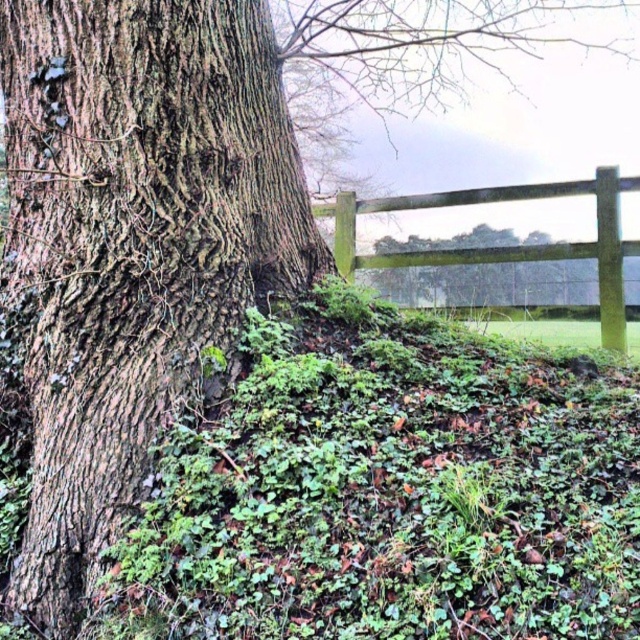
Question: Which of these objects is positioned farthest from the green wood fence at center?

Choices:
 (A) brown rough bark tree trunk at left
 (B) green mossy tree at center

Answer: (A)

Question: Which object is positioned farthest from the brown rough bark tree trunk at left?

Choices:
 (A) green mossy tree at center
 (B) green wood fence at center

Answer: (A)

Question: Which point appears closest to the camera in this image?

Choices:
 (A) (490, 289)
 (B) (378, 205)
 (C) (152, 298)

Answer: (C)

Question: Is brown rough bark tree trunk at left smaller than green mossy tree at center?

Choices:
 (A) yes
 (B) no

Answer: (B)

Question: Is brown rough bark tree trunk at left further to the viewer compared to green mossy tree at center?

Choices:
 (A) yes
 (B) no

Answer: (B)

Question: Can you confirm if brown rough bark tree trunk at left is positioned to the right of green wood fence at center?

Choices:
 (A) yes
 (B) no

Answer: (B)